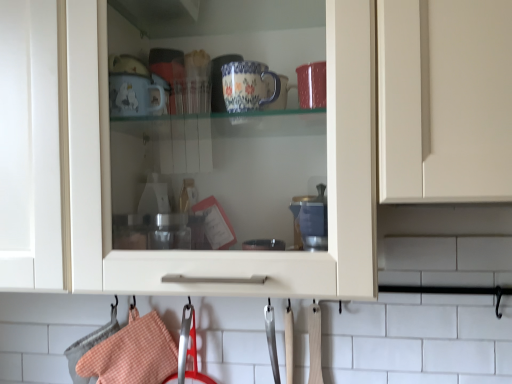
What do you see at coordinates (133, 353) in the screenshot? This screenshot has width=512, height=384. I see `pink checkered oven mitt at lower left` at bounding box center [133, 353].

Looking at this image, measure the distance between pink checkered oven mitt at lower left and camera.

They are 37.69 inches apart.

Locate an element on the screen. pink checkered oven mitt at lower left is located at coordinates (133, 353).

Measure the distance between point (162,336) and camera.

Point (162,336) and camera are 1.00 meters apart from each other.

In order to click on pink checkered oven mitt at lower left in this screenshot , I will do (x=133, y=353).